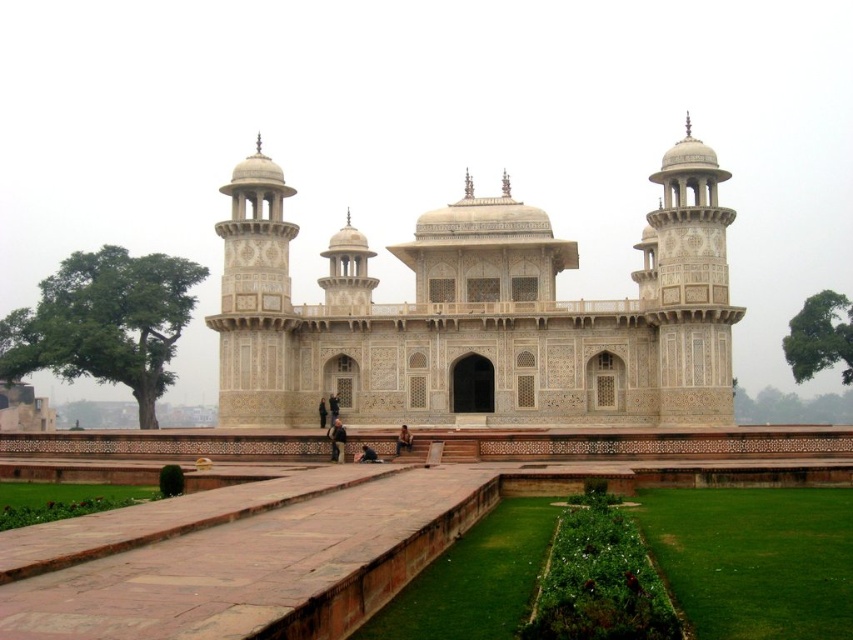
Between smooth beige person at center and dark gray suit at center, which one is positioned lower?

smooth beige person at center is below.

Does smooth beige person at center have a larger size compared to dark gray suit at center?

Correct, smooth beige person at center is larger in size than dark gray suit at center.

Which is in front, point (405, 440) or point (318, 403)?

Point (405, 440) is in front.

This screenshot has height=640, width=853. I want to click on smooth beige person at center, so click(x=403, y=440).

Who is shorter, white marble palace at center or dark blue fabric at center?

dark blue fabric at center

Who is more distant from viewer, (273, 342) or (334, 413)?

Positioned behind is point (334, 413).

Locate an element on the screen. Image resolution: width=853 pixels, height=640 pixels. white marble palace at center is located at coordinates (479, 314).

This screenshot has height=640, width=853. Find the location of `white marble palace at center`. white marble palace at center is located at coordinates (479, 314).

How distant is smooth beige person at center from dark blue fabric at center?

12.49 meters

Does smooth beige person at center appear under dark blue fabric at center?

Yes.

Which is in front, point (402, 426) or point (331, 417)?

Positioned in front is point (331, 417).

The width and height of the screenshot is (853, 640). Find the location of `smooth beige person at center`. smooth beige person at center is located at coordinates (403, 440).